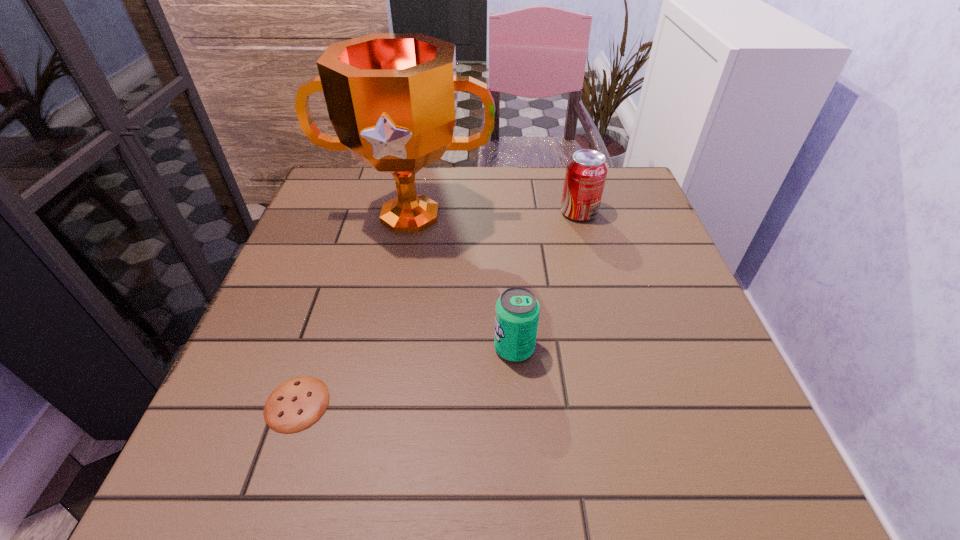
I want to click on object situated at the near left corner, so click(295, 405).

Image resolution: width=960 pixels, height=540 pixels. I want to click on object located in the far right corner section of the desktop, so click(586, 171).

The image size is (960, 540). Find the location of `vacant space at the far edge`. vacant space at the far edge is located at coordinates (540, 181).

Identify the location of free spot at the near edge of the desktop. This screenshot has height=540, width=960. (495, 491).

What are the coordinates of `vacant space at the left edge of the desktop` in the screenshot? It's located at (325, 333).

Image resolution: width=960 pixels, height=540 pixels. In the image, there is a desktop. What are the coordinates of `vacant space at the right edge` in the screenshot? It's located at pos(677,403).

At what (x,y) coordinates should I click in order to perform the action: click on vacant space at the far left corner of the desktop. Please return your answer as a coordinate pair (x, y). Looking at the image, I should click on (364, 188).

In the image, there is a desktop. Where is `free region at the far right corner`? This screenshot has width=960, height=540. free region at the far right corner is located at coordinates (613, 190).

The image size is (960, 540). I want to click on unoccupied position between the shortest object and the shorter pop soda, so click(406, 376).

Identify the location of vacant area that lies between the shortest object and the right pop soda. (438, 308).